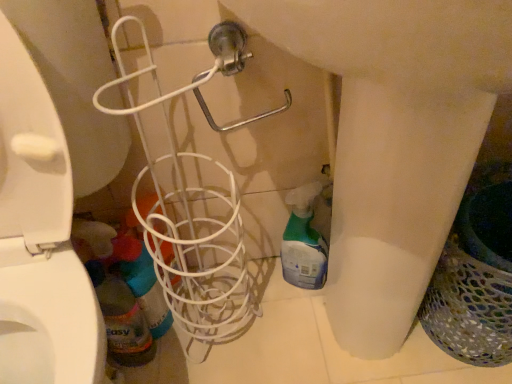
Question: Does translucent plastic spray bottle at lower left, the 2th cleaning product when ordered from right to left, lie behind white wire basket at center?

Choices:
 (A) no
 (B) yes

Answer: (B)

Question: Would you say translucent plastic spray bottle at lower left, the 2th cleaning product when ordered from right to left, contains white wire basket at center?

Choices:
 (A) no
 (B) yes

Answer: (A)

Question: Does translucent plastic spray bottle at lower left, the 1th cleaning product in the left-to-right sequence, have a greater height compared to white wire basket at center?

Choices:
 (A) yes
 (B) no

Answer: (B)

Question: Considering the relative sizes of translucent plastic spray bottle at lower left, the 2th cleaning product when ordered from right to left, and white wire basket at center in the image provided, is translucent plastic spray bottle at lower left, the 2th cleaning product when ordered from right to left, wider than white wire basket at center?

Choices:
 (A) yes
 (B) no

Answer: (B)

Question: Is translucent plastic spray bottle at lower left, the 2th cleaning product when ordered from right to left, to the left of white wire basket at center from the viewer's perspective?

Choices:
 (A) yes
 (B) no

Answer: (A)

Question: Looking at the image, does translucent plastic spray bottle at lower left, the 1th cleaning product in the left-to-right sequence, seem bigger or smaller compared to translucent plastic spray bottle at lower center, arranged as the 2th cleaning product when viewed from the left?

Choices:
 (A) small
 (B) big

Answer: (A)

Question: In terms of height, does translucent plastic spray bottle at lower left, the 1th cleaning product in the left-to-right sequence, look taller or shorter compared to translucent plastic spray bottle at lower center, which is the first cleaning product from right to left?

Choices:
 (A) tall
 (B) short

Answer: (B)

Question: Is translucent plastic spray bottle at lower left, the 1th cleaning product in the left-to-right sequence, in front of or behind translucent plastic spray bottle at lower center, arranged as the 2th cleaning product when viewed from the left, in the image?

Choices:
 (A) behind
 (B) front

Answer: (B)

Question: Which is correct: translucent plastic spray bottle at lower left, the 1th cleaning product in the left-to-right sequence, is inside translucent plastic spray bottle at lower center, which is the first cleaning product from right to left, or outside of it?

Choices:
 (A) outside
 (B) inside

Answer: (A)

Question: Is white wire basket at center to the left or to the right of metallic silver shower at upper center in the image?

Choices:
 (A) left
 (B) right

Answer: (B)

Question: From the image's perspective, is white wire basket at center located above or below metallic silver shower at upper center?

Choices:
 (A) below
 (B) above

Answer: (A)

Question: Does point tap(360, 307) appear closer or farther from the camera than point tap(108, 87)?

Choices:
 (A) closer
 (B) farther

Answer: (B)

Question: In terms of height, does white wire basket at center look taller or shorter compared to metallic silver shower at upper center?

Choices:
 (A) tall
 (B) short

Answer: (A)

Question: In terms of height, does multicolored mesh laundry basket at right look taller or shorter compared to translucent plastic spray bottle at lower left, the 2th cleaning product when ordered from right to left?

Choices:
 (A) tall
 (B) short

Answer: (A)

Question: Looking at their shapes, would you say multicolored mesh laundry basket at right is wider or thinner than translucent plastic spray bottle at lower left, the 1th cleaning product in the left-to-right sequence?

Choices:
 (A) thin
 (B) wide

Answer: (B)